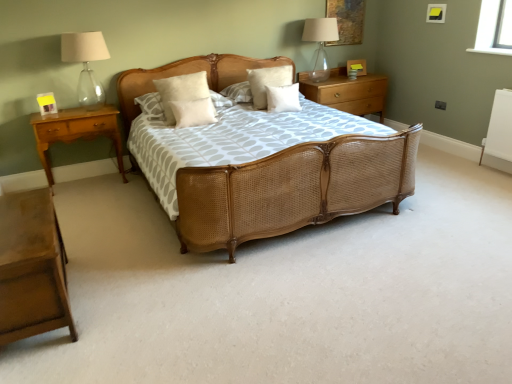
The image size is (512, 384). What do you see at coordinates (348, 92) in the screenshot? I see `wooden nightstand at right, which is counted as the third nightstand, starting from the bottom` at bounding box center [348, 92].

Describe the element at coordinates (320, 44) in the screenshot. Image resolution: width=512 pixels, height=384 pixels. I see `transparent glass table lamp at upper right, which is the 1th table lamp from right to left` at that location.

Describe the element at coordinates (76, 132) in the screenshot. This screenshot has width=512, height=384. I see `light brown wood nightstand at left, which is the 2th nightstand from front to back` at that location.

Where is `white matte pillow at center, acting as the fourth pillow starting from the left`? white matte pillow at center, acting as the fourth pillow starting from the left is located at coordinates (283, 98).

What are the coordinates of `light brown wood nightstand at lower left, acting as the second nightstand starting from the right` in the screenshot? It's located at [32, 268].

Is white fluffy pillow at center, positioned as the 2th pillow in right-to-left order, not within white soft pillow at center, placed as the 1th pillow when sorted from left to right?

Yes, white fluffy pillow at center, positioned as the 2th pillow in right-to-left order, is not within white soft pillow at center, placed as the 1th pillow when sorted from left to right.

The width and height of the screenshot is (512, 384). In order to click on pillow that is the 2nd one when counting downward from the white fluffy pillow at center, the 3th pillow positioned from the left (from the image's perspective) in this screenshot , I will do `click(186, 100)`.

From a real-world perspective, between white fluffy pillow at center, positioned as the 2th pillow in right-to-left order, and white soft pillow at center, placed as the 1th pillow when sorted from left to right, who is vertically higher?

white soft pillow at center, placed as the 1th pillow when sorted from left to right, from a real-world perspective.

Does point (262, 87) come in front of point (169, 86)?

No, it is not.

Can you confirm if light brown wood nightstand at lower left, acting as the second nightstand starting from the right, is bigger than white fluffy pillow at center, the 3th pillow positioned from the left?

Yes, light brown wood nightstand at lower left, acting as the second nightstand starting from the right, is bigger than white fluffy pillow at center, the 3th pillow positioned from the left.

How far apart are light brown wood nightstand at lower left, the first nightstand viewed from the front, and white fluffy pillow at center, positioned as the 2th pillow in right-to-left order?

A distance of 2.51 meters exists between light brown wood nightstand at lower left, the first nightstand viewed from the front, and white fluffy pillow at center, positioned as the 2th pillow in right-to-left order.

Can you confirm if light brown wood nightstand at lower left, the first nightstand viewed from the front, is positioned to the left of white fluffy pillow at center, positioned as the 2th pillow in right-to-left order?

Yes, light brown wood nightstand at lower left, the first nightstand viewed from the front, is to the left of white fluffy pillow at center, positioned as the 2th pillow in right-to-left order.

Is light brown wood nightstand at lower left, which is the first nightstand from bottom to top, far away from white fluffy pillow at center, positioned as the 2th pillow in right-to-left order?

That's right, there is a large distance between light brown wood nightstand at lower left, which is the first nightstand from bottom to top, and white fluffy pillow at center, positioned as the 2th pillow in right-to-left order.

Could you measure the distance between light brown wood nightstand at left, which appears as the 2th nightstand when viewed from the back, and white soft pillow at center, the second pillow when ordered from left to right?

32.73 inches.

From a real-world perspective, is light brown wood nightstand at left, placed as the second nightstand when sorted from top to bottom, positioned above or below white soft pillow at center, the third pillow in the right-to-left sequence?

light brown wood nightstand at left, placed as the second nightstand when sorted from top to bottom, is below white soft pillow at center, the third pillow in the right-to-left sequence.

Considering the relative sizes of light brown wood nightstand at left, which ranks as the 2th nightstand in bottom-to-top order, and white soft pillow at center, the second pillow when ordered from left to right, in the image provided, is light brown wood nightstand at left, which ranks as the 2th nightstand in bottom-to-top order, wider than white soft pillow at center, the second pillow when ordered from left to right,?

Indeed, light brown wood nightstand at left, which ranks as the 2th nightstand in bottom-to-top order, has a greater width compared to white soft pillow at center, the second pillow when ordered from left to right.

Considering the positions of objects light brown wood nightstand at left, which is the 2th nightstand from front to back, and white soft pillow at center, the third pillow in the right-to-left sequence, in the image provided, who is more to the left, light brown wood nightstand at left, which is the 2th nightstand from front to back, or white soft pillow at center, the third pillow in the right-to-left sequence,?

light brown wood nightstand at left, which is the 2th nightstand from front to back, is more to the left.

Which object is positioned more to the left, transparent glass table lamp at upper right, placed as the second table lamp when sorted from left to right, or white soft pillow at center, the third pillow in the right-to-left sequence?

Positioned to the left is white soft pillow at center, the third pillow in the right-to-left sequence.

At what (x,y) coordinates should I click in order to perform the action: click on the 3rd pillow to the left of the transparent glass table lamp at upper right, placed as the second table lamp when sorted from left to right, starting your count from the anchor. Please return your answer as a coordinate pair (x, y). Looking at the image, I should click on (193, 112).

Is transparent glass table lamp at upper right, which is the 2th table lamp from front to back, positioned far away from white soft pillow at center, the third pillow in the right-to-left sequence?

Yes, transparent glass table lamp at upper right, which is the 2th table lamp from front to back, and white soft pillow at center, the third pillow in the right-to-left sequence, are quite far apart.

Would you say transparent glass table lamp at upper right, acting as the 1th table lamp starting from the back, is outside white soft pillow at center, the third pillow in the right-to-left sequence?

Yes, transparent glass table lamp at upper right, acting as the 1th table lamp starting from the back, is not within white soft pillow at center, the third pillow in the right-to-left sequence.

Is clear glass table lamp at upper left, which is the second table lamp in back-to-front order, next to woven wood bed at center and touching it?

No, clear glass table lamp at upper left, which is the second table lamp in back-to-front order, is not making contact with woven wood bed at center.

Which object is wider, clear glass table lamp at upper left, acting as the 1th table lamp starting from the front, or woven wood bed at center?

With larger width is woven wood bed at center.

From a real-world perspective, which object stands above the other?

clear glass table lamp at upper left, which is the second table lamp in back-to-front order, is physically above.

From the picture: Is light brown wood nightstand at lower left, which is the second nightstand from left to right, positioned with its back to clear glass table lamp at upper left, marked as the 1th table lamp in a left-to-right arrangement?

No, light brown wood nightstand at lower left, which is the second nightstand from left to right, is not facing away from clear glass table lamp at upper left, marked as the 1th table lamp in a left-to-right arrangement.

Can you confirm if light brown wood nightstand at lower left, which is the first nightstand from bottom to top, is positioned to the left of clear glass table lamp at upper left, marked as the 1th table lamp in a left-to-right arrangement?

No, light brown wood nightstand at lower left, which is the first nightstand from bottom to top, is not to the left of clear glass table lamp at upper left, marked as the 1th table lamp in a left-to-right arrangement.

Does light brown wood nightstand at lower left, placed as the third nightstand when sorted from top to bottom, have a smaller size compared to clear glass table lamp at upper left, arranged as the second table lamp when viewed from the right?

Actually, light brown wood nightstand at lower left, placed as the third nightstand when sorted from top to bottom, might be larger than clear glass table lamp at upper left, arranged as the second table lamp when viewed from the right.

At what (x,y) coordinates should I click in order to perform the action: click on the 2nd table lamp positioned above the light brown wood nightstand at lower left, acting as the second nightstand starting from the right (from a real-world perspective). Please return your answer as a coordinate pair (x, y). This screenshot has width=512, height=384. Looking at the image, I should click on (86, 64).

You are a GUI agent. You are given a task and a screenshot of the screen. Output one action in this format:
    pyautogui.click(x=<x>, y=<y>)
    Task: Click on the bed that is below the wooden nightstand at right, the 1th nightstand in the back-to-front sequence (from the image's perspective)
    This screenshot has height=384, width=512.
    Given the screenshot: What is the action you would take?
    pyautogui.click(x=292, y=189)

From a real-world perspective, relative to wooden nightstand at right, the third nightstand when ordered from front to back, is woven wood bed at center vertically above or below?

woven wood bed at center is above wooden nightstand at right, the third nightstand when ordered from front to back.

Which is farther, (304,165) or (312,94)?

The point (312,94) is farther from the camera.

From a real-world perspective, starting from the white soft pillow at center, the fourth pillow positioned from the right, which pillow is the 1st one below it? Please provide its 2D coordinates.

[(267, 82)]

From the white fluffy pillow at center, positioned as the 2th pillow in right-to-left order, count the 1st nightstand to the left and point to it. Please provide its 2D coordinates.

[(32, 268)]

When comparing their distances from light brown wood nightstand at left, placed as the second nightstand when sorted from top to bottom, does light brown wood nightstand at lower left, arranged as the third nightstand when viewed from the back, or woven wood bed at center seem further?

Among the two, woven wood bed at center is located further to light brown wood nightstand at left, placed as the second nightstand when sorted from top to bottom.

Which object lies nearer to the anchor point light brown wood nightstand at lower left, the first nightstand viewed from the front, white soft pillow at center, the second pillow when ordered from left to right, or light brown wood nightstand at left, placed as the second nightstand when sorted from top to bottom?

Among the two, light brown wood nightstand at left, placed as the second nightstand when sorted from top to bottom, is located nearer to light brown wood nightstand at lower left, the first nightstand viewed from the front.

From the image, which object appears to be farther from light brown wood nightstand at lower left, which is the first nightstand from bottom to top, white matte pillow at center, acting as the fourth pillow starting from the left, or wooden nightstand at right, arranged as the first nightstand when viewed from the top?

wooden nightstand at right, arranged as the first nightstand when viewed from the top, is further to light brown wood nightstand at lower left, which is the first nightstand from bottom to top.

Which object lies nearer to the anchor point wooden nightstand at right, arranged as the first nightstand when viewed from the top, light brown wood nightstand at left, which ranks as the 2th nightstand in bottom-to-top order, or white matte pillow at center, which is the first pillow from right to left?

white matte pillow at center, which is the first pillow from right to left, is positioned closer to the anchor wooden nightstand at right, arranged as the first nightstand when viewed from the top.

When comparing their distances from white soft pillow at center, the second pillow when ordered from left to right, does clear glass table lamp at upper left, arranged as the second table lamp when viewed from the right, or white fluffy pillow at center, the 3th pillow positioned from the left, seem further?

Among the two, clear glass table lamp at upper left, arranged as the second table lamp when viewed from the right, is located further to white soft pillow at center, the second pillow when ordered from left to right.

Considering their positions, is clear glass table lamp at upper left, arranged as the second table lamp when viewed from the right, positioned closer to white matte pillow at center, acting as the fourth pillow starting from the left, than white soft pillow at center, the third pillow in the right-to-left sequence?

Among the two, white soft pillow at center, the third pillow in the right-to-left sequence, is located nearer to white matte pillow at center, acting as the fourth pillow starting from the left.

When comparing their distances from transparent glass table lamp at upper right, which is the 1th table lamp from right to left, does white soft pillow at center, placed as the 1th pillow when sorted from left to right, or light brown wood nightstand at left, the 1th nightstand viewed from the left, seem closer?

white soft pillow at center, placed as the 1th pillow when sorted from left to right, lies closer to transparent glass table lamp at upper right, which is the 1th table lamp from right to left, than the other object.

Looking at the image, which one is located further to wooden nightstand at right, arranged as the first nightstand when viewed from the top, clear glass table lamp at upper left, acting as the 1th table lamp starting from the front, or light brown wood nightstand at left, which appears as the 2th nightstand when viewed from the back?

clear glass table lamp at upper left, acting as the 1th table lamp starting from the front.

This screenshot has width=512, height=384. Identify the location of bed positioned between light brown wood nightstand at lower left, acting as the second nightstand starting from the right, and white matte pillow at center, which is the first pillow from right to left, from near to far. (292, 189).

The image size is (512, 384). In order to click on table lamp between light brown wood nightstand at lower left, which is the second nightstand from left to right, and light brown wood nightstand at left, the third nightstand from the right, along the z-axis in this screenshot , I will do `click(86, 64)`.

This screenshot has height=384, width=512. Find the location of `pillow between light brown wood nightstand at lower left, which is the first nightstand from bottom to top, and white soft pillow at center, placed as the 1th pillow when sorted from left to right, in the front-back direction`. pillow between light brown wood nightstand at lower left, which is the first nightstand from bottom to top, and white soft pillow at center, placed as the 1th pillow when sorted from left to right, in the front-back direction is located at coordinates (193, 112).

Where is `bed between light brown wood nightstand at lower left, placed as the third nightstand when sorted from top to bottom, and light brown wood nightstand at left, which appears as the 2th nightstand when viewed from the back, from front to back`? bed between light brown wood nightstand at lower left, placed as the third nightstand when sorted from top to bottom, and light brown wood nightstand at left, which appears as the 2th nightstand when viewed from the back, from front to back is located at coordinates (292, 189).